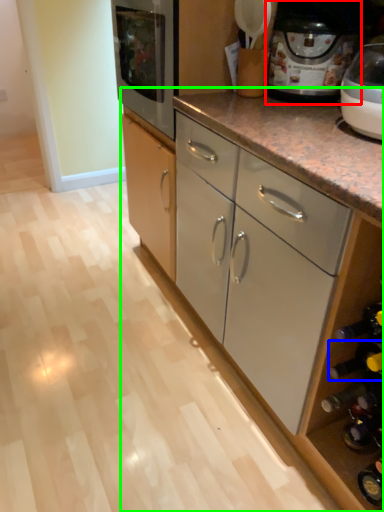
Question: Which object is positioned farthest from home appliance (highlighted by a red box)? Select from wine bottle (highlighted by a blue box) and cabinetry (highlighted by a green box).

Choices:
 (A) wine bottle
 (B) cabinetry

Answer: (A)